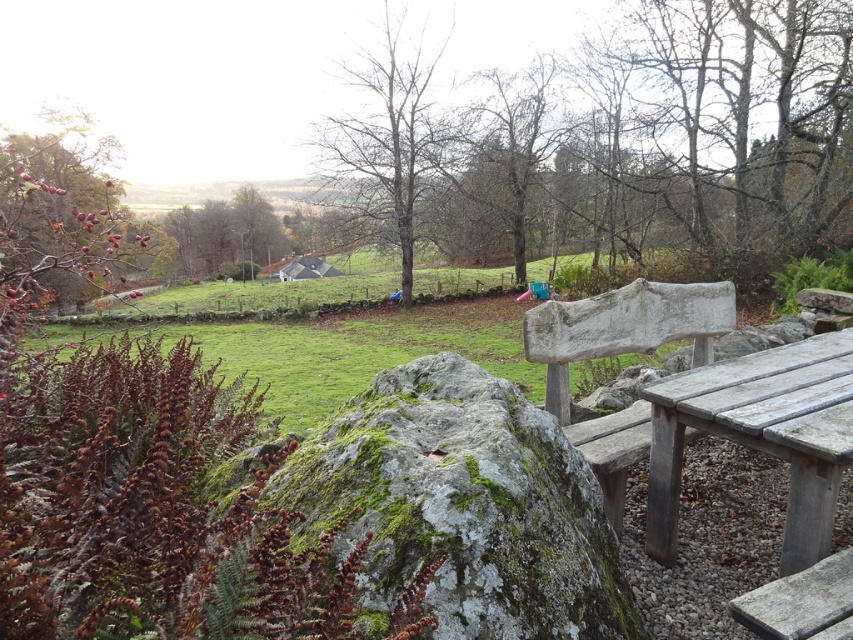
Is the position of green mossy rock at center more distant than that of weathered wood bench at center-right?

No.

Can you confirm if green mossy rock at center is positioned below weathered wood bench at center-right?

Correct, green mossy rock at center is located below weathered wood bench at center-right.

This screenshot has height=640, width=853. What are the coordinates of `green mossy rock at center` in the screenshot? It's located at (463, 506).

Who is higher up, green grassy field at center or bare wood tree at center?

Positioned higher is bare wood tree at center.

Does point (224, 285) come closer to viewer compared to point (318, 161)?

No, it is behind (318, 161).

This screenshot has width=853, height=640. In order to click on green grassy field at center in this screenshot , I will do `click(340, 348)`.

This screenshot has height=640, width=853. What are the coordinates of `green grassy field at center` in the screenshot? It's located at (340, 348).

Does green mossy rock at center appear under gray weathered wood bench at lower right?

Actually, green mossy rock at center is above gray weathered wood bench at lower right.

Is green mossy rock at center wider than gray weathered wood bench at lower right?

Yes.

Is point (581, 516) farther from viewer compared to point (776, 632)?

Yes, it is behind point (776, 632).

Identify the location of green mossy rock at center. This screenshot has width=853, height=640. (463, 506).